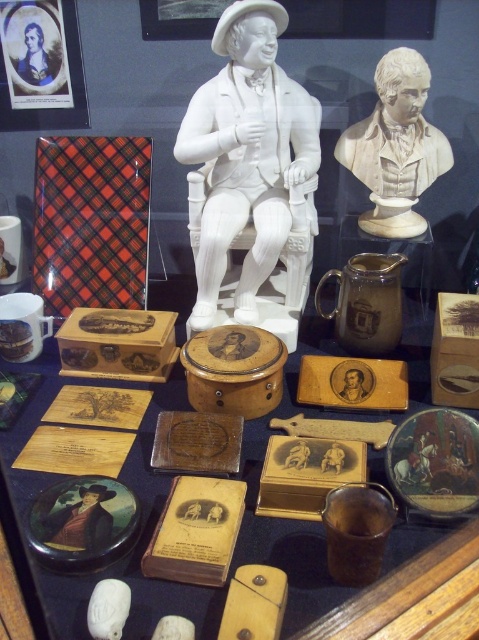
Question: Is white marble bust at upper right wider than matte wooden portrait at center?

Choices:
 (A) yes
 (B) no

Answer: (A)

Question: Considering the relative positions of white marble bust at upper right and matte wooden portrait at center in the image provided, where is white marble bust at upper right located with respect to matte wooden portrait at center?

Choices:
 (A) right
 (B) left

Answer: (A)

Question: Which of these objects is positioned closest to the wooden box at center?

Choices:
 (A) white marble bust at upper right
 (B) matte wooden portrait at center
 (C) white porcelain statue at center

Answer: (B)

Question: Which point is farther to the camera?

Choices:
 (A) (45, 536)
 (B) (211, 298)

Answer: (B)

Question: Does white porcelain statue at center lie in front of white marble bust at upper right?

Choices:
 (A) no
 (B) yes

Answer: (B)

Question: Which point is farther to the camera?

Choices:
 (A) wooden box at center
 (B) matte wooden portrait at center
 (C) white marble bust at upper right
 (D) white porcelain statue at center

Answer: (C)